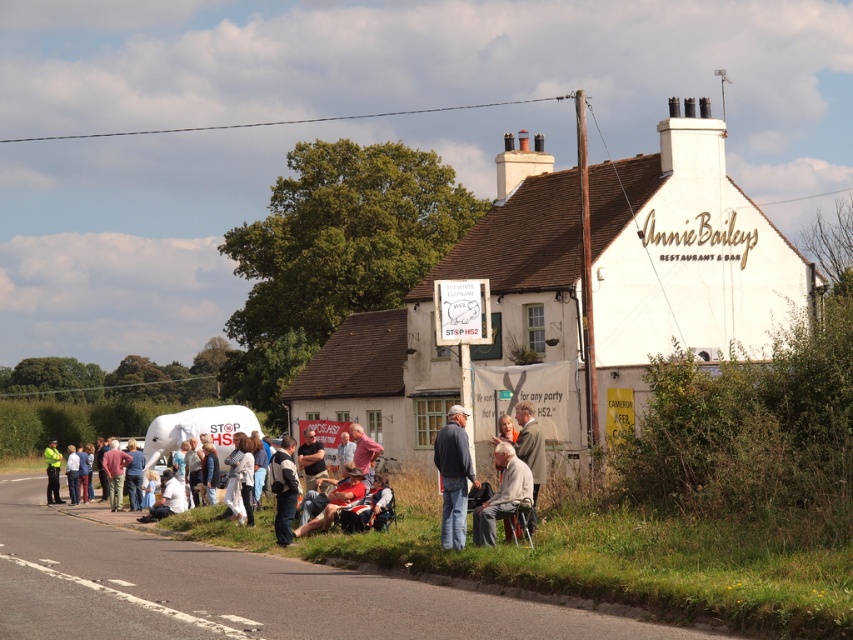
Which of these two, light beige fabric chair at lower center or dark gray sweater at center, stands shorter?

Standing shorter between the two is light beige fabric chair at lower center.

Can you confirm if light beige fabric chair at lower center is smaller than dark gray sweater at center?

Yes.

The width and height of the screenshot is (853, 640). In order to click on light beige fabric chair at lower center in this screenshot , I will do pos(502,493).

I want to click on light beige fabric chair at lower center, so click(502, 493).

Does denim jacket at center appear over dark gray sweater at center?

Yes, denim jacket at center is above dark gray sweater at center.

Does denim jacket at center have a larger size compared to dark gray sweater at center?

Indeed, denim jacket at center has a larger size compared to dark gray sweater at center.

Is point (447, 509) more distant than point (283, 465)?

No.

Identify the location of denim jacket at center. (453, 476).

Between denim jacket at center and light gray fabric jacket at center, which one appears on the left side from the viewer's perspective?

denim jacket at center

Does denim jacket at center have a lesser width compared to light gray fabric jacket at center?

Incorrect, denim jacket at center's width is not less than light gray fabric jacket at center's.

This screenshot has height=640, width=853. What do you see at coordinates (453, 476) in the screenshot? I see `denim jacket at center` at bounding box center [453, 476].

You are a GUI agent. You are given a task and a screenshot of the screen. Output one action in this format:
    pyautogui.click(x=<x>, y=<y>)
    Task: Click on the denim jacket at center
    The height and width of the screenshot is (640, 853).
    Given the screenshot: What is the action you would take?
    pyautogui.click(x=453, y=476)